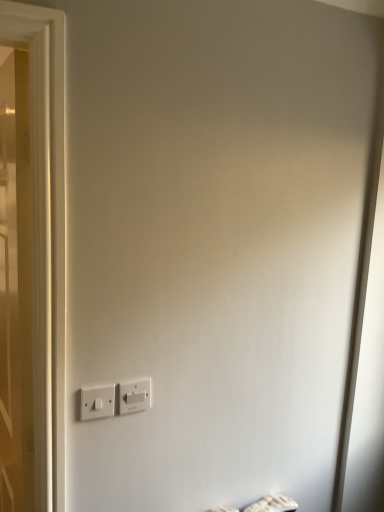
Question: From the image's perspective, is white plastic power plugs and sockets at lower left, which is the first power plugs and sockets from left to right, under white wooden door at left?

Choices:
 (A) yes
 (B) no

Answer: (A)

Question: Does white plastic power plugs and sockets at lower left, which is the first power plugs and sockets from left to right, have a greater width compared to white wooden door at left?

Choices:
 (A) yes
 (B) no

Answer: (B)

Question: Is white plastic power plugs and sockets at lower left, which is the first power plugs and sockets from left to right, surrounding white wooden door at left?

Choices:
 (A) yes
 (B) no

Answer: (B)

Question: Is white plastic power plugs and sockets at lower left, which is the first power plugs and sockets from left to right, further to camera compared to white wooden door at left?

Choices:
 (A) no
 (B) yes

Answer: (B)

Question: Are white plastic power plugs and sockets at lower left, which is counted as the second power plugs and sockets, starting from the right, and white wooden door at left far apart?

Choices:
 (A) yes
 (B) no

Answer: (B)

Question: Is white wooden door at left bigger or smaller than white plastic power plugs and sockets at lower left, which is counted as the second power plugs and sockets, starting from the right?

Choices:
 (A) small
 (B) big

Answer: (B)

Question: Is white wooden door at left inside or outside of white plastic power plugs and sockets at lower left, which is the first power plugs and sockets from left to right?

Choices:
 (A) outside
 (B) inside

Answer: (A)

Question: From the image's perspective, relative to white plastic power plugs and sockets at lower left, which is counted as the second power plugs and sockets, starting from the right, is white wooden door at left above or below?

Choices:
 (A) below
 (B) above

Answer: (B)

Question: From a real-world perspective, relative to white plastic power plugs and sockets at lower left, which is counted as the second power plugs and sockets, starting from the right, is white wooden door at left vertically above or below?

Choices:
 (A) below
 (B) above

Answer: (A)

Question: Is white plastic power plugs and sockets at lower left, which is counted as the second power plugs and sockets, starting from the right, bigger or smaller than white plastic power plugs and sockets at lower center, arranged as the 1th power plugs and sockets when viewed from the right?

Choices:
 (A) small
 (B) big

Answer: (B)

Question: In terms of height, does white plastic power plugs and sockets at lower left, which is counted as the second power plugs and sockets, starting from the right, look taller or shorter compared to white plastic power plugs and sockets at lower center, arranged as the 1th power plugs and sockets when viewed from the right?

Choices:
 (A) short
 (B) tall

Answer: (A)

Question: From a real-world perspective, is white plastic power plugs and sockets at lower left, which is counted as the second power plugs and sockets, starting from the right, physically located above or below white plastic power plugs and sockets at lower center, the 2th power plugs and sockets when ordered from left to right?

Choices:
 (A) below
 (B) above

Answer: (B)

Question: Is white plastic power plugs and sockets at lower left, which is counted as the second power plugs and sockets, starting from the right, inside or outside of white plastic power plugs and sockets at lower center, arranged as the 1th power plugs and sockets when viewed from the right?

Choices:
 (A) inside
 (B) outside

Answer: (B)

Question: Does point (105, 410) appear closer or farther from the camera than point (21, 466)?

Choices:
 (A) closer
 (B) farther

Answer: (A)

Question: Considering their positions, is white plastic power plugs and sockets at lower left, which is the first power plugs and sockets from left to right, located in front of or behind white wooden door at left?

Choices:
 (A) front
 (B) behind

Answer: (B)